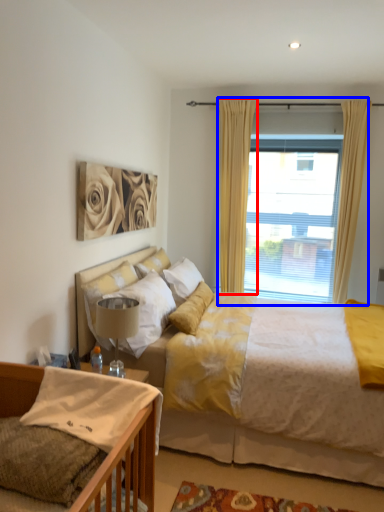
Question: Which object is further to the camera taking this photo, curtain (highlighted by a red box) or window (highlighted by a blue box)?

Choices:
 (A) curtain
 (B) window

Answer: (B)